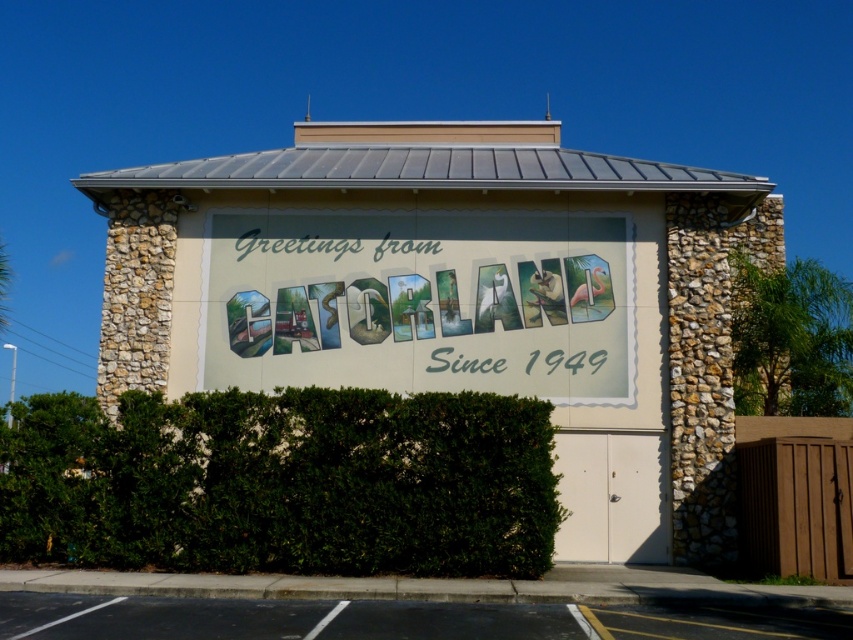
Question: Is green leafy hedge at lower center in front of pastel painted sign at center?

Choices:
 (A) yes
 (B) no

Answer: (A)

Question: Which point is farther to the camera?

Choices:
 (A) (363, 632)
 (B) (422, 545)

Answer: (B)

Question: Is green leafy hedge at lower center to the left of pastel painted sign at center from the viewer's perspective?

Choices:
 (A) no
 (B) yes

Answer: (B)

Question: Which object appears farthest from the camera in this image?

Choices:
 (A) black asphalt at lower center
 (B) green leafy hedge at lower center
 (C) pastel painted sign at center

Answer: (C)

Question: Which object is farther from the camera taking this photo?

Choices:
 (A) green leafy hedge at lower center
 (B) pastel painted sign at center

Answer: (B)

Question: Is green leafy hedge at lower center to the right of pastel painted sign at center from the viewer's perspective?

Choices:
 (A) yes
 (B) no

Answer: (B)